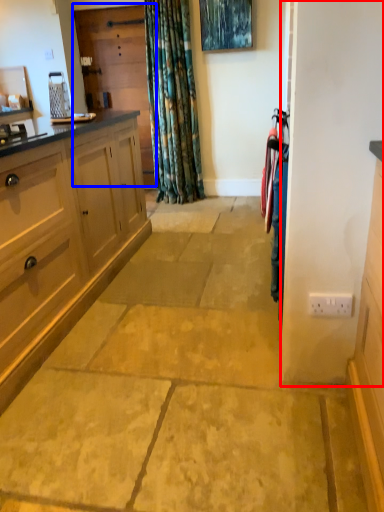
Question: Which object appears closest to the camera in this image, screen door (highlighted by a red box) or screen door (highlighted by a blue box)?

Choices:
 (A) screen door
 (B) screen door

Answer: (A)